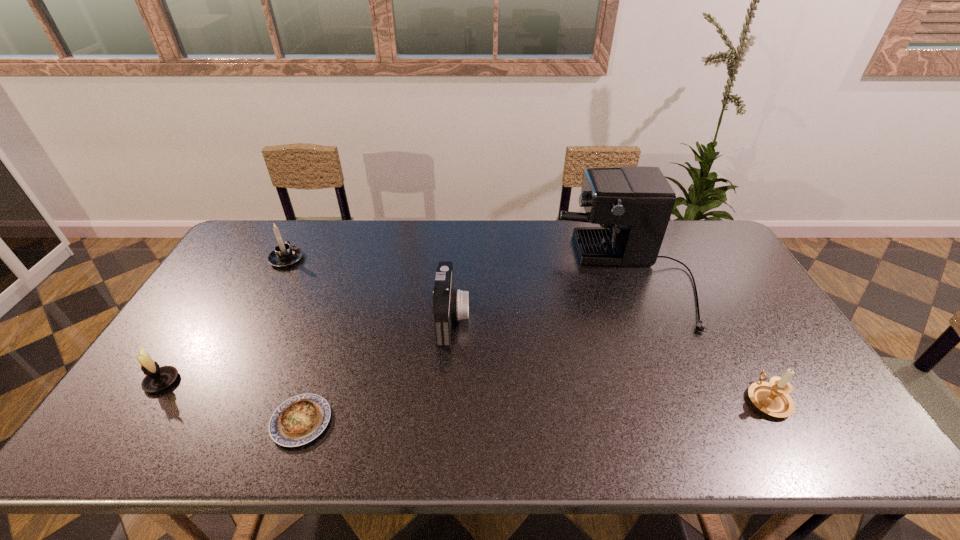
At what (x,y) coordinates should I click in order to perform the action: click on vacant space located 0.180m on the front-facing side of the coffee maker. Please return your answer as a coordinate pair (x, y). Image resolution: width=960 pixels, height=540 pixels. Looking at the image, I should click on (507, 277).

Locate an element on the screen. The width and height of the screenshot is (960, 540). free space located 0.120m with a handle on the side of the second candle holder from right to left is located at coordinates (302, 229).

I want to click on vacant region located with a handle on the side of the second candle holder from right to left, so click(x=300, y=234).

At what (x,y) coordinates should I click in order to perform the action: click on vacant area located with a handle on the side of the second candle holder from right to left. Please return your answer as a coordinate pair (x, y). The height and width of the screenshot is (540, 960). Looking at the image, I should click on (298, 237).

I want to click on blank space located 0.230m on the lens of the fourth object from left to right, so click(x=547, y=318).

This screenshot has width=960, height=540. What are the coordinates of `free space located 0.110m on the front of the leftmost candle holder` in the screenshot? It's located at (126, 436).

Where is `vacant space located 0.200m with a handle on the side of the rightmost candle holder`? vacant space located 0.200m with a handle on the side of the rightmost candle holder is located at coordinates (723, 321).

Identify the location of vacant space located with a handle on the side of the rightmost candle holder. The height and width of the screenshot is (540, 960). (715, 307).

This screenshot has width=960, height=540. What are the coordinates of `vacant area situated 0.400m with a handle on the side of the rightmost candle holder` in the screenshot? It's located at (698, 276).

Find the location of a particular element. The height and width of the screenshot is (540, 960). free location located on the left of the quiche is located at coordinates (225, 422).